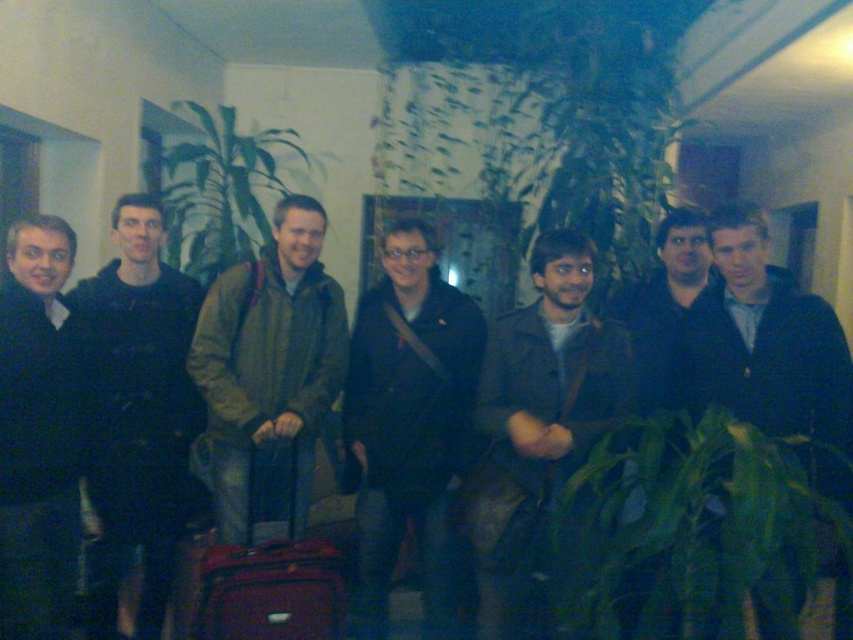
Question: Which point is closer to the camera?

Choices:
 (A) green matte jacket at center
 (B) matte red suitcase at center

Answer: (B)

Question: Which point is closer to the camera taking this photo?

Choices:
 (A) (701, 323)
 (B) (258, 296)
 (C) (262, 528)

Answer: (A)

Question: Is green matte jacket at center positioned in front of dark blue jacket at center?

Choices:
 (A) no
 (B) yes

Answer: (A)

Question: Which is farther from the dark blue fabric jacket at center?

Choices:
 (A) black matte jacket at center
 (B) matte red suitcase at center
 (C) black matte sweater at left
 (D) green matte jacket at center

Answer: (A)

Question: Is dark blue fabric jacket at center below black matte sweater at left?

Choices:
 (A) no
 (B) yes

Answer: (B)

Question: Is dark blue fabric jacket at center positioned at the back of black matte jacket at center?

Choices:
 (A) yes
 (B) no

Answer: (B)